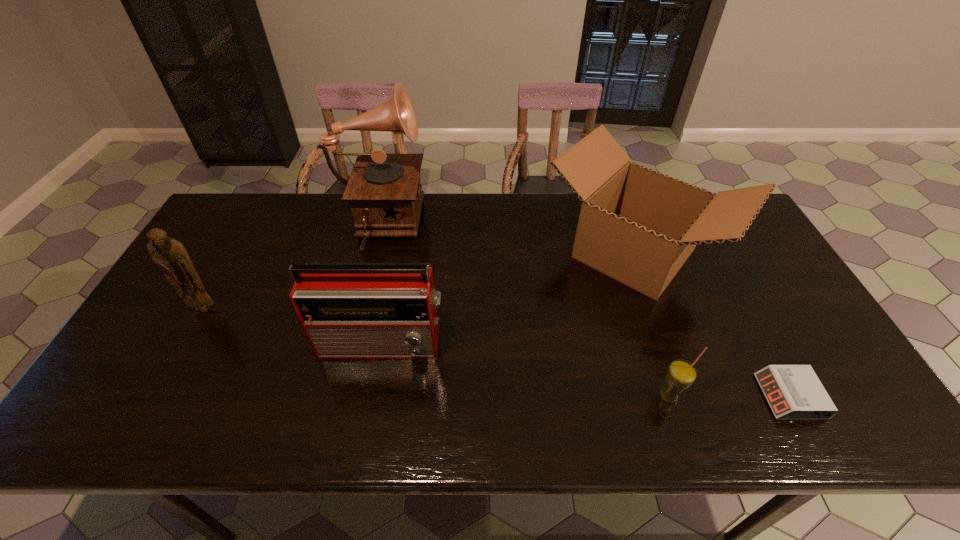
Find the location of a particular element. the tallest object is located at coordinates (384, 190).

Where is `box`? Image resolution: width=960 pixels, height=540 pixels. box is located at coordinates (638, 226).

In order to click on figurine in this screenshot , I will do `click(170, 254)`.

What are the coordinates of `the fourth farthest object` in the screenshot? It's located at (348, 310).

In order to click on straw for drinking in this screenshot , I will do `click(681, 374)`.

In order to click on the shortest object in this screenshot , I will do `click(794, 392)`.

Image resolution: width=960 pixels, height=540 pixels. Identify the location of free spot located 0.110m on the horn of the record player. (459, 228).

The width and height of the screenshot is (960, 540). Identify the location of free space located 0.140m on the left of the box. (496, 253).

What are the coordinates of `vacant space located on the front-facing side of the figurine` in the screenshot? It's located at 173,366.

Locate an element on the screen. This screenshot has height=540, width=960. free space located 0.110m on the front-facing side of the radio receiver is located at coordinates (372, 403).